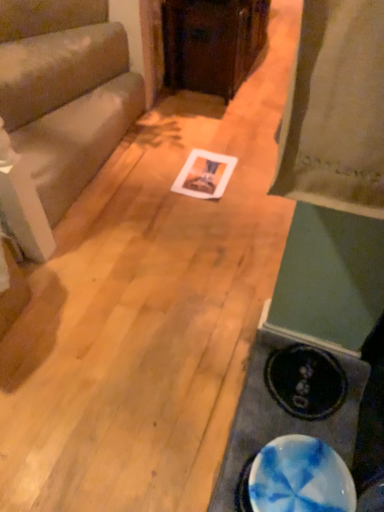
Where is `free spot to the left of blue marbled plate at lower right`? Image resolution: width=384 pixels, height=512 pixels. free spot to the left of blue marbled plate at lower right is located at coordinates (186, 454).